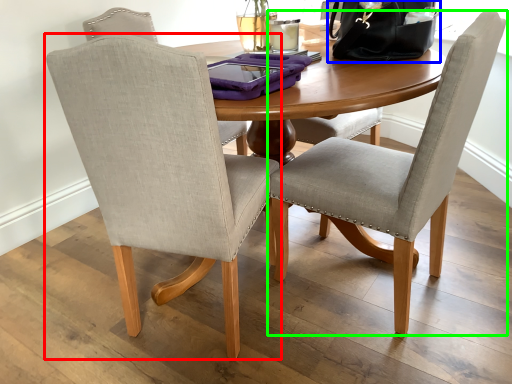
Question: Which is farther away from chair (highlighted by a red box)? handbag (highlighted by a blue box) or chair (highlighted by a green box)?

Choices:
 (A) handbag
 (B) chair

Answer: (A)